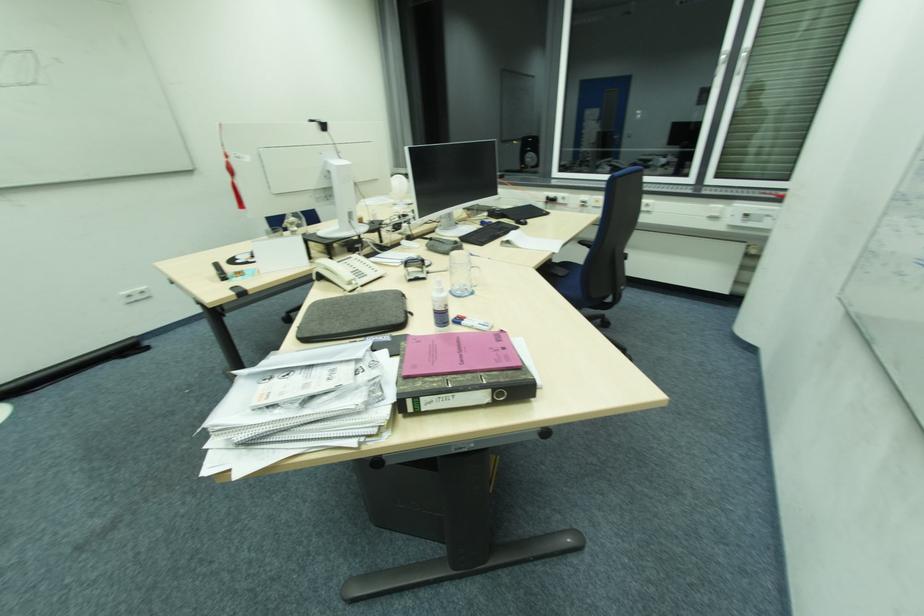
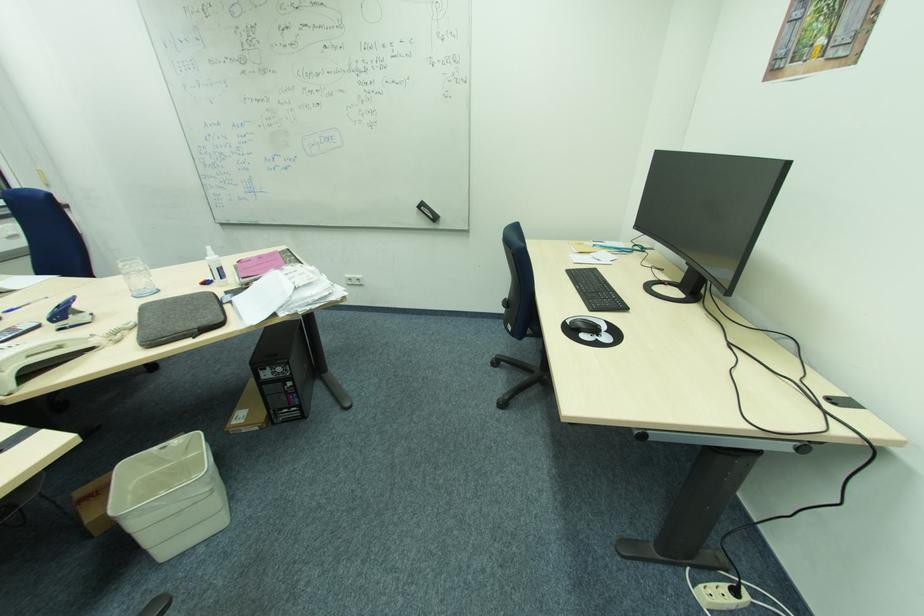
In the second image, find the point that corresponds to (x=348, y=331) in the first image.

(222, 306)